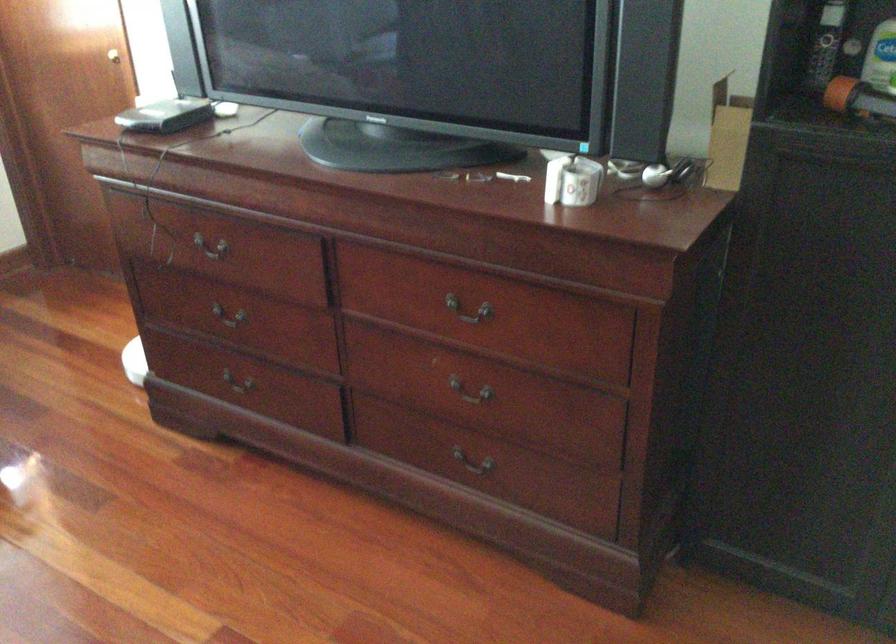
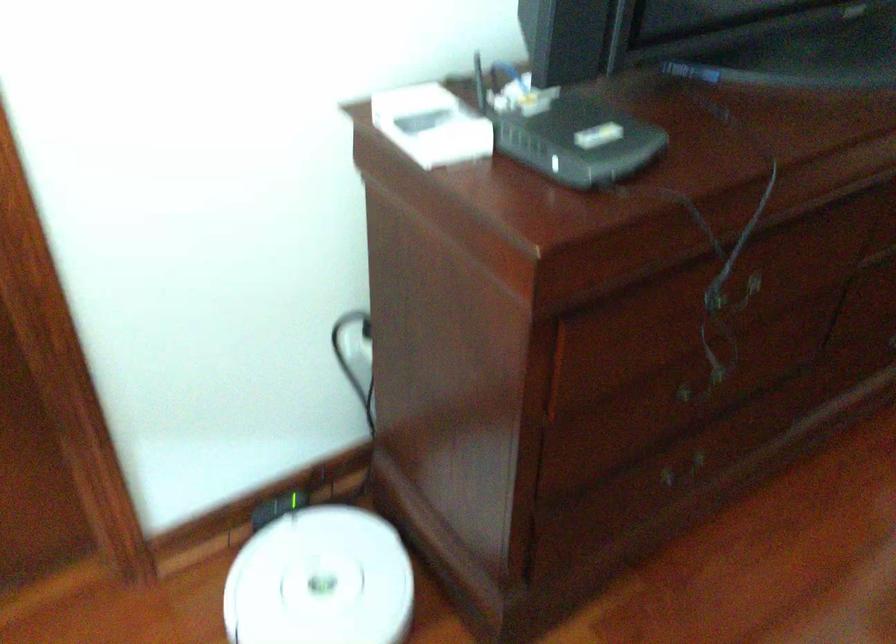
In the second image, find the point that corresponds to the point at 158,120 in the first image.

(569, 134)